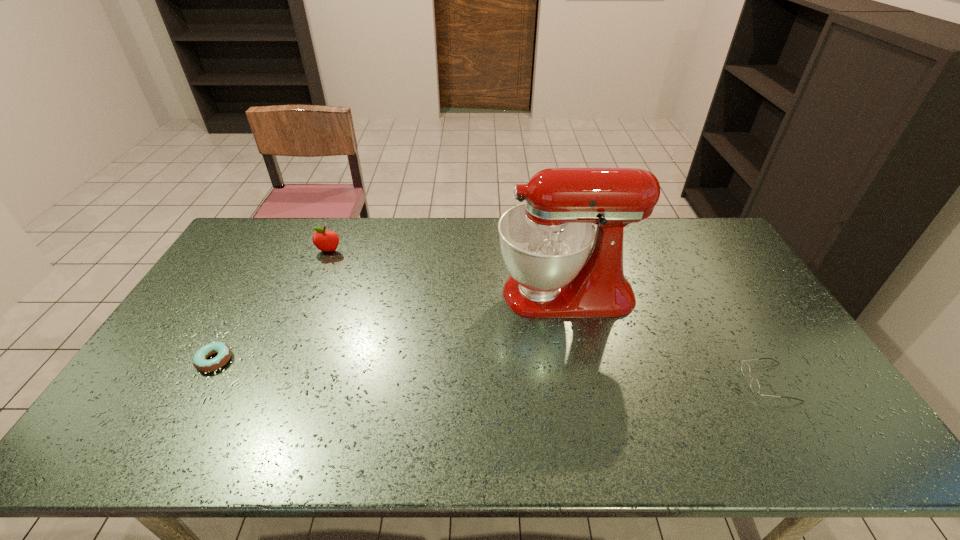
Find the location of a particular element. vacant space at the near edge of the desktop is located at coordinates (557, 435).

Where is `free spot at the left edge of the desktop`? This screenshot has height=540, width=960. free spot at the left edge of the desktop is located at coordinates (231, 286).

The width and height of the screenshot is (960, 540). Find the location of `free spot at the right edge of the desktop`. free spot at the right edge of the desktop is located at coordinates (781, 338).

What are the coordinates of `free space at the far left corner` in the screenshot? It's located at (279, 225).

Find the location of a particular element. The width and height of the screenshot is (960, 540). free space between the tallest object and the second tallest object is located at coordinates (447, 272).

Where is `vacant region between the spectacles and the second object from right to left`? This screenshot has width=960, height=540. vacant region between the spectacles and the second object from right to left is located at coordinates (667, 338).

Locate an element on the screen. This screenshot has width=960, height=540. free point between the second farthest object and the apple is located at coordinates (x=447, y=272).

This screenshot has width=960, height=540. Identify the location of unoccupied position between the tallest object and the second object from left to right. (447, 272).

At what (x,y) coordinates should I click in order to perform the action: click on vacant area that lies between the third object from left to right and the doughnut. Please return your answer as a coordinate pair (x, y). This screenshot has width=960, height=540. Looking at the image, I should click on (390, 327).

Where is `vacant space that is in between the second tallest object and the third object from left to right`? vacant space that is in between the second tallest object and the third object from left to right is located at coordinates (447, 272).